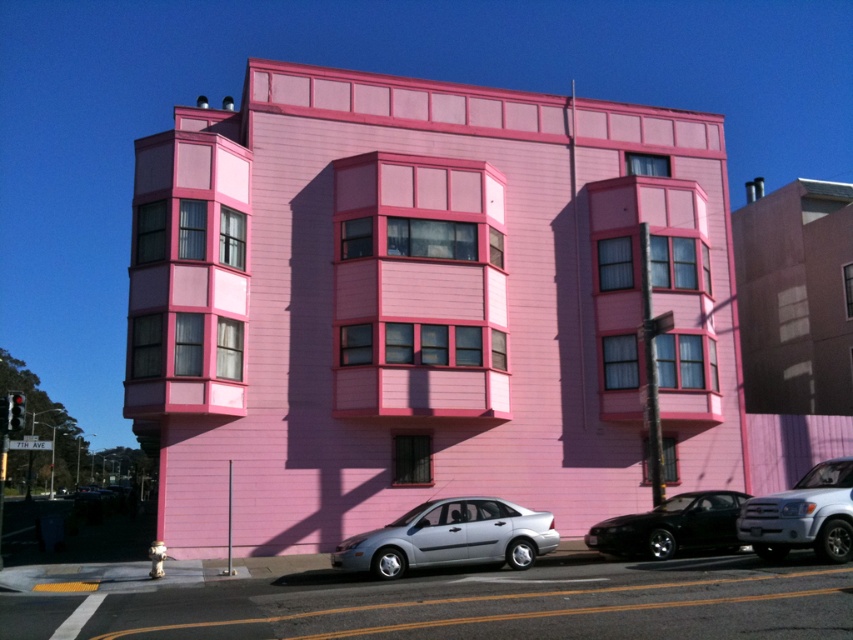
Question: Can you confirm if satin silver sedan at center is positioned to the left of shiny black car at lower right?

Choices:
 (A) no
 (B) yes

Answer: (B)

Question: Is satin silver sedan at center below shiny black car at lower right?

Choices:
 (A) no
 (B) yes

Answer: (A)

Question: Which of these objects is positioned farthest from the satin silver sedan at center?

Choices:
 (A) shiny black car at lower right
 (B) satin white suv at lower right

Answer: (B)

Question: Which object is closer to the camera taking this photo?

Choices:
 (A) shiny black car at lower right
 (B) satin white suv at lower right
 (C) satin silver sedan at center

Answer: (B)

Question: Which point is farther to the camera?

Choices:
 (A) satin silver sedan at center
 (B) shiny black car at lower right
 (C) satin white suv at lower right

Answer: (B)

Question: Is satin silver sedan at center to the left of shiny black car at lower right from the viewer's perspective?

Choices:
 (A) yes
 (B) no

Answer: (A)